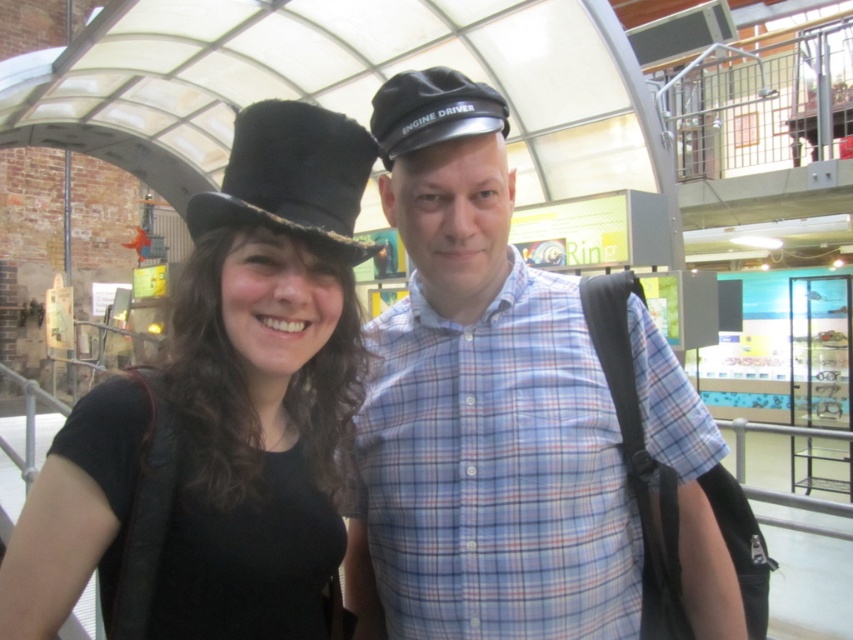
In the scene shown: You are designing a poster and need to know which object in the image takes up more visual space. The scene has a blue plaid shirt at center and a black fabric cap at center. Which one is larger in size?

The blue plaid shirt at center has a larger size compared to the black fabric cap at center, so the blue plaid shirt at center takes up more visual space.

You are standing in the station and need to locate the matte black hat at left. According to the coordinates provided, where would you look to find it?

The matte black hat at left is located at point [219,416].

You are designing a new uniform for the staff at this station. The blue plaid shirt at center and the black fabric cap at center are part of the current uniform. If you want to ensure that the new uniform items have the same proportions as the current ones, which item should you make wider when creating the new shirt and cap?

The blue plaid shirt at center is wider than the black fabric cap at center, so when designing the new uniform, you should make the new shirt wider than the new cap to maintain the same proportions.